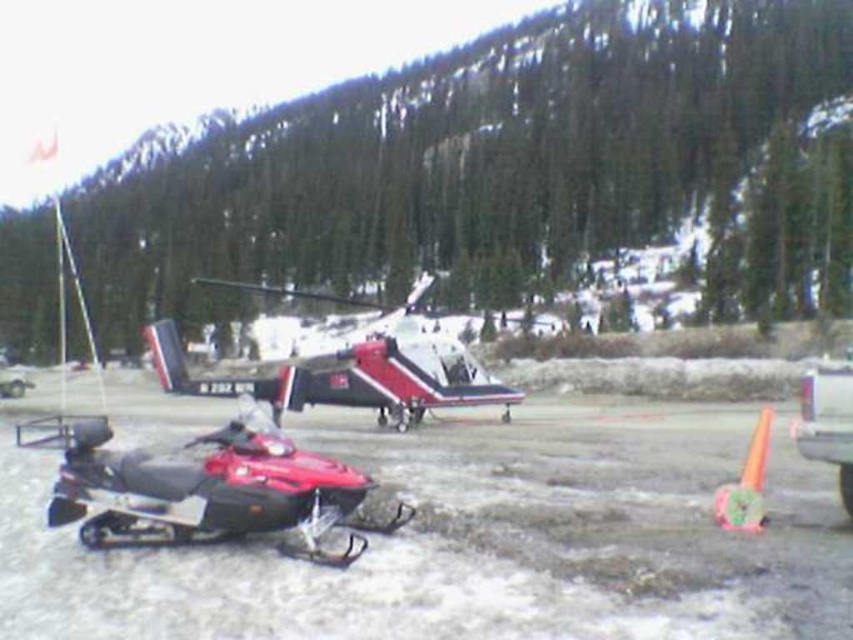
Question: Which of the following is the closest to the observer?

Choices:
 (A) orange rubber cone at lower right
 (B) shiny red plastic snowmobile at lower left

Answer: (B)

Question: Is white matte helicopter at center further to camera compared to orange rubber cone at lower right?

Choices:
 (A) no
 (B) yes

Answer: (B)

Question: Is shiny red plastic snowmobile at lower left to the right of white matte helicopter at center from the viewer's perspective?

Choices:
 (A) yes
 (B) no

Answer: (A)

Question: Which point is farther to the camera?

Choices:
 (A) (428, 356)
 (B) (741, 499)
 (C) (335, 483)

Answer: (A)

Question: Is shiny red plastic snowmobile at lower left closer to the viewer compared to white matte helicopter at center?

Choices:
 (A) yes
 (B) no

Answer: (A)

Question: Which point is closer to the camera?

Choices:
 (A) (494, 384)
 (B) (767, 435)

Answer: (B)